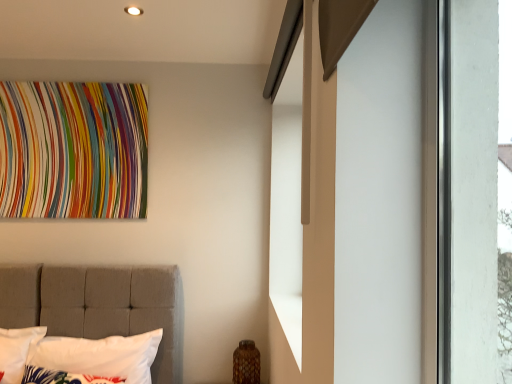
At what (x,y) coordinates should I click in order to perform the action: click on blank space situated above multicolored fabric tapestry at upper left (from a real-world perspective). Please return your answer as a coordinate pair (x, y). The width and height of the screenshot is (512, 384). Looking at the image, I should click on (69, 76).